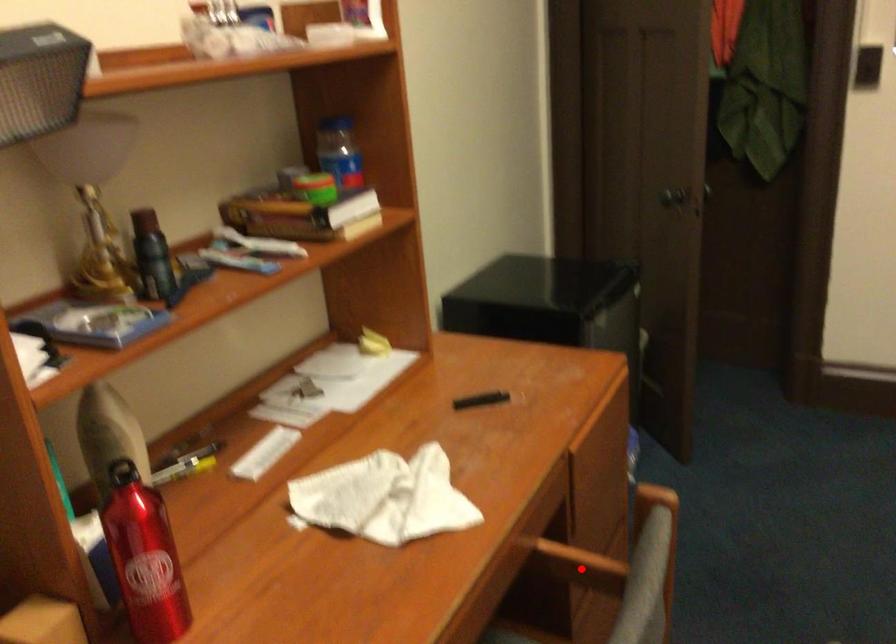
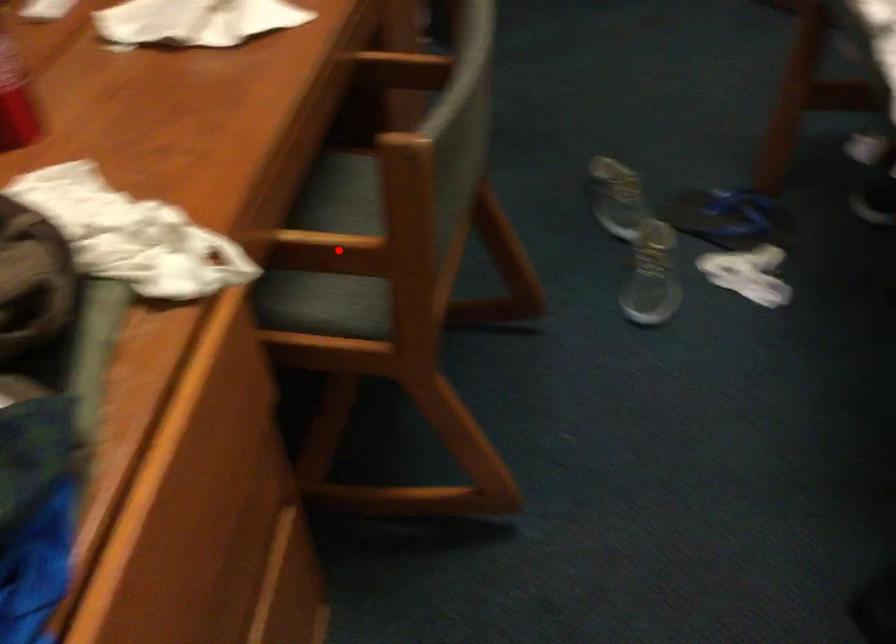
I am providing you with two images of the same scene from different viewpoints. A red point is marked on the first image and another point is marked on the second image. Does the point marked in image1 correspond to the same location as the one in image2?

No